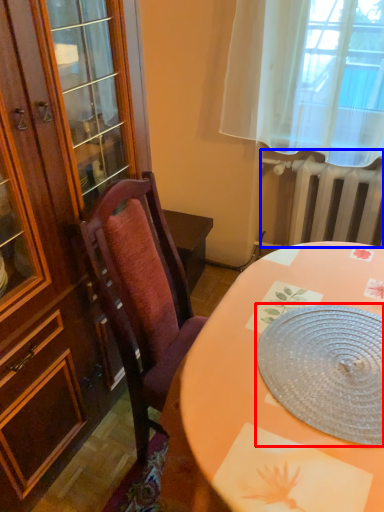
Question: Which of the following is the closest to the observer, platter (highlighted by a red box) or radiator (highlighted by a blue box)?

Choices:
 (A) platter
 (B) radiator

Answer: (A)